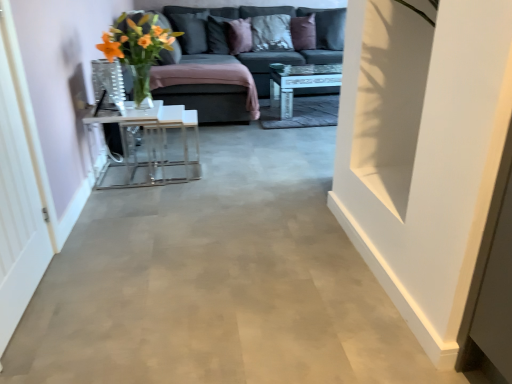
The image size is (512, 384). I want to click on free point behind clear glass table at center, marked as the 2th table in a top-to-bottom arrangement, so click(148, 157).